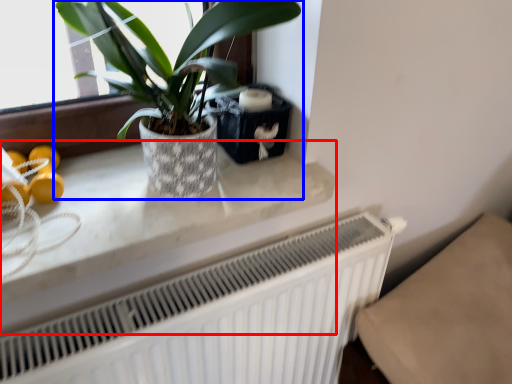
Question: Which of the following is the farthest to the observer, counter top (highlighted by a red box) or houseplant (highlighted by a blue box)?

Choices:
 (A) counter top
 (B) houseplant

Answer: (A)